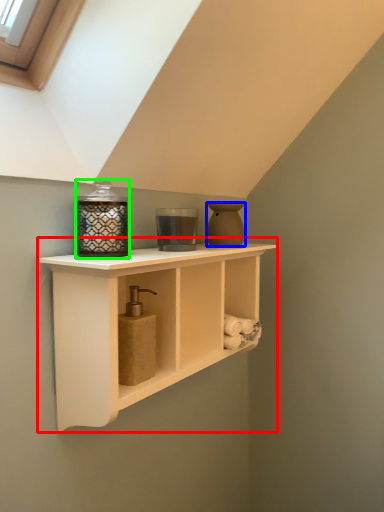
Question: Based on their relative distances, which object is nearer to shelf (highlighted by a red box)? Choose from vase (highlighted by a blue box) and candle holder (highlighted by a green box).

Choices:
 (A) vase
 (B) candle holder

Answer: (B)